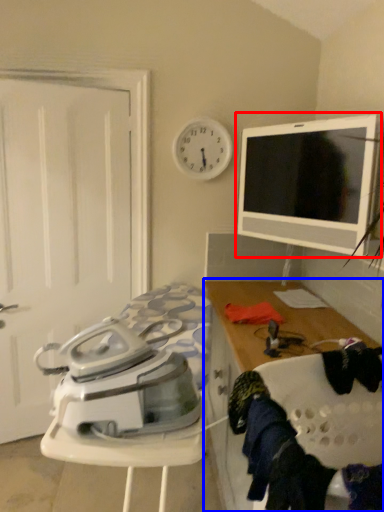
Question: Among these objects, which one is farthest to the camera, tableware (highlighted by a red box) or cabinetry (highlighted by a blue box)?

Choices:
 (A) tableware
 (B) cabinetry

Answer: (A)